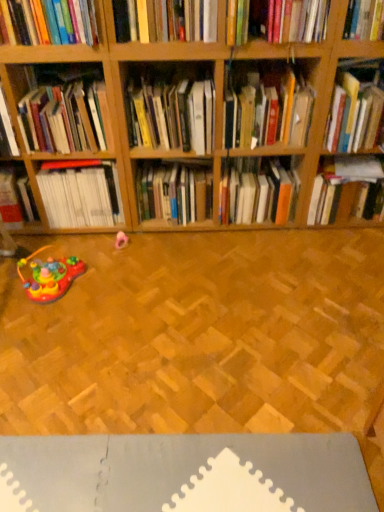
The image size is (384, 512). What are the coordinates of `vacant space to the right of rubberized plastic toy at lower left, which appears as the 2th toy when viewed from the top` in the screenshot? It's located at (115, 284).